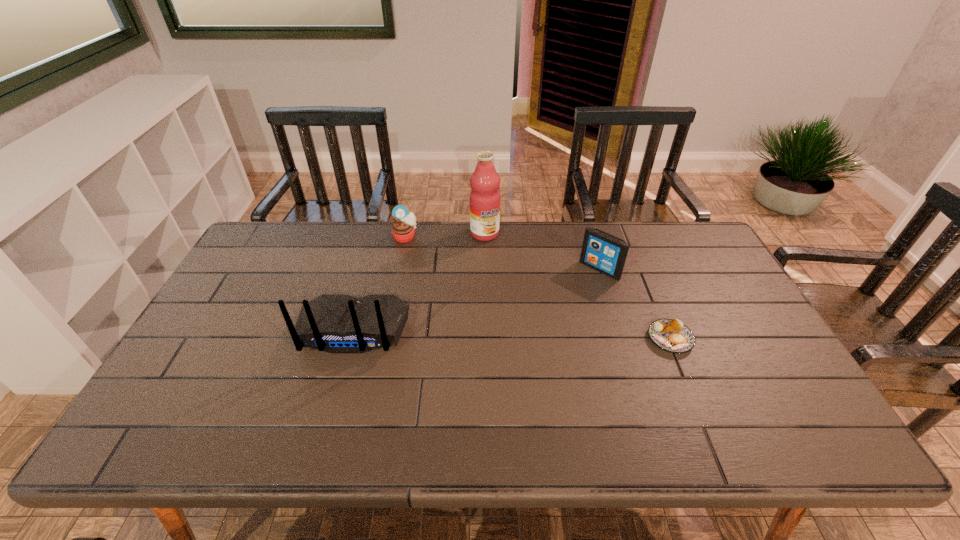
At what (x,y) coordinates should I click in order to perform the action: click on vacant region that satisfies the following two spatial constraints: 1. on the back side of the muffin; 2. on the right side of the tallest object. Please return your answer as a coordinate pair (x, y). This screenshot has height=540, width=960. Looking at the image, I should click on (406, 233).

You are a GUI agent. You are given a task and a screenshot of the screen. Output one action in this format:
    pyautogui.click(x=<x>, y=<y>)
    Task: Click on the vacant space that satisfies the following two spatial constraints: 1. on the back of the shortest object; 2. on the right side of the router
    Image resolution: width=960 pixels, height=540 pixels.
    Given the screenshot: What is the action you would take?
    pyautogui.click(x=350, y=339)

At what (x,y) coordinates should I click in order to perform the action: click on vacant space that satisfies the following two spatial constraints: 1. on the front side of the pastry; 2. on the left side of the third object from right to left. Please return your answer as a coordinate pair (x, y). The width and height of the screenshot is (960, 540). Looking at the image, I should click on (486, 339).

This screenshot has width=960, height=540. Find the location of `vacant space that satisfies the following two spatial constraints: 1. on the back of the second tallest object; 2. on the right side of the shortest object`. vacant space that satisfies the following two spatial constraints: 1. on the back of the second tallest object; 2. on the right side of the shortest object is located at coordinates (350, 339).